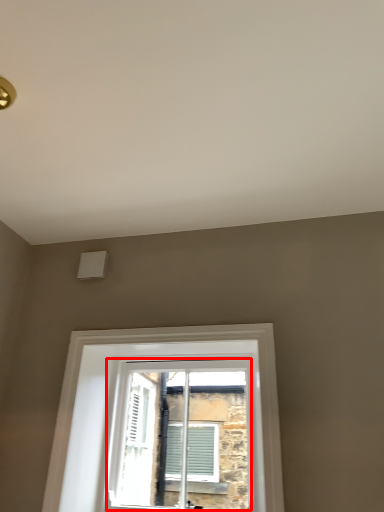
Question: From the image's perspective, what is the correct spatial positioning of window (annotated by the red box) in reference to window?

Choices:
 (A) above
 (B) below

Answer: (B)